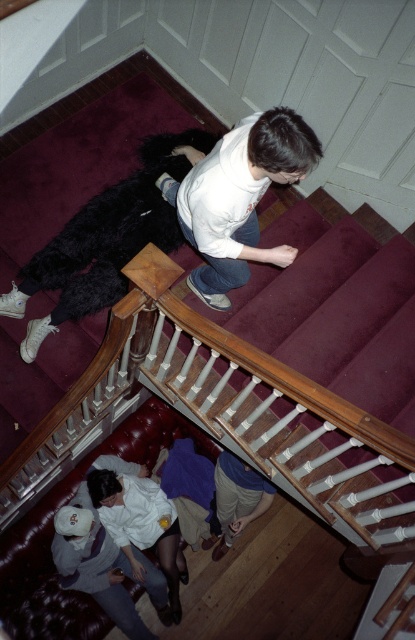
Consider the image. You are a delivery person trying to determine if there is enough space to place a small package between the white matte shirt at upper center and the white fabric shirt at lower left. Based on their sizes, can you fit the package there?

The white matte shirt at upper center occupies less space than the white fabric shirt at lower left. Since the white matte shirt at upper center is smaller, there might be enough space between them to place the package, but the exact fit depends on the package size relative to the smaller object.

You are a delivery person trying to deliver a package to the person wearing the white matte shirt at upper center. The package is too heavy to carry upstairs. Can you place it near the white fabric shirt at lower left without the person noticing?

The white matte shirt at upper center is positioned over the white fabric shirt at lower left, meaning the white fabric shirt at lower left is below and out of the person upper center view. Yes, you can place the package near the white fabric shirt at lower left without the person noticing.